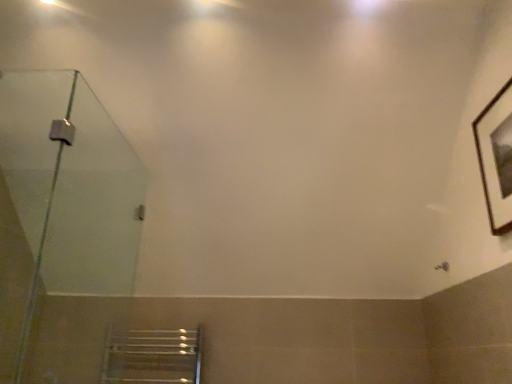
Question: From the image's perspective, is brown wooden picture frame at upper right below transparent glass shower door at left?

Choices:
 (A) yes
 (B) no

Answer: (B)

Question: Is brown wooden picture frame at upper right completely or partially outside of transparent glass shower door at left?

Choices:
 (A) no
 (B) yes

Answer: (B)

Question: Considering the relative sizes of brown wooden picture frame at upper right and transparent glass shower door at left in the image provided, is brown wooden picture frame at upper right bigger than transparent glass shower door at left?

Choices:
 (A) no
 (B) yes

Answer: (A)

Question: From a real-world perspective, is brown wooden picture frame at upper right on transparent glass shower door at left?

Choices:
 (A) yes
 (B) no

Answer: (A)

Question: Is brown wooden picture frame at upper right in contact with transparent glass shower door at left?

Choices:
 (A) no
 (B) yes

Answer: (A)

Question: Is brown wooden picture frame at upper right taller than transparent glass shower door at left?

Choices:
 (A) yes
 (B) no

Answer: (B)

Question: Is transparent glass shower door at left wider than brown wooden picture frame at upper right?

Choices:
 (A) yes
 (B) no

Answer: (A)

Question: From the image's perspective, is transparent glass shower door at left located beneath brown wooden picture frame at upper right?

Choices:
 (A) yes
 (B) no

Answer: (A)

Question: Is transparent glass shower door at left smaller than brown wooden picture frame at upper right?

Choices:
 (A) no
 (B) yes

Answer: (A)

Question: Does transparent glass shower door at left have a greater height compared to brown wooden picture frame at upper right?

Choices:
 (A) yes
 (B) no

Answer: (A)

Question: Is the position of transparent glass shower door at left less distant than that of brown wooden picture frame at upper right?

Choices:
 (A) yes
 (B) no

Answer: (A)

Question: From a real-world perspective, is transparent glass shower door at left on brown wooden picture frame at upper right?

Choices:
 (A) yes
 (B) no

Answer: (B)

Question: From a real-world perspective, is transparent glass shower door at left physically located above or below brown wooden picture frame at upper right?

Choices:
 (A) above
 (B) below

Answer: (B)